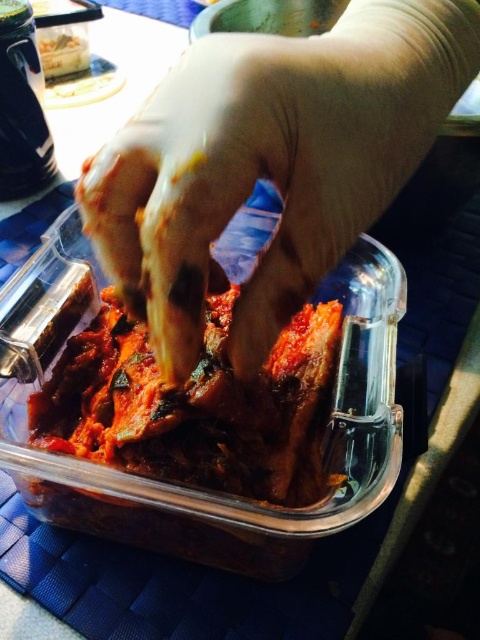
Question: Which point is closer to the camera?

Choices:
 (A) (375, 16)
 (B) (72, 413)

Answer: (A)

Question: Which of the following is the closest to the observer?

Choices:
 (A) (170, 451)
 (B) (291, 221)

Answer: (B)

Question: Can you confirm if gloved hand at center is wider than dark red glossy kimchi at center?

Choices:
 (A) no
 (B) yes

Answer: (B)

Question: Can you confirm if gloved hand at center is positioned below dark red glossy kimchi at center?

Choices:
 (A) yes
 (B) no

Answer: (B)

Question: Can you confirm if gloved hand at center is bigger than dark red glossy kimchi at center?

Choices:
 (A) yes
 (B) no

Answer: (A)

Question: Which object appears farthest from the camera in this image?

Choices:
 (A) gloved hand at center
 (B) dark red glossy kimchi at center

Answer: (B)